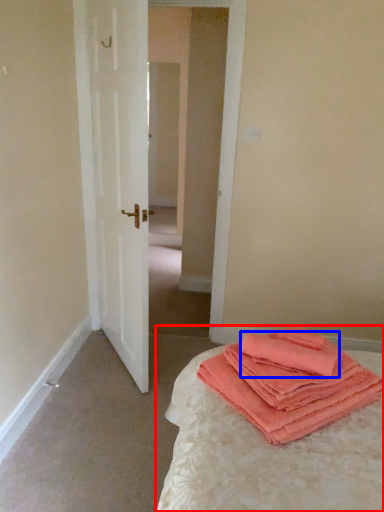
Question: Which point is closer to the camera, bed (highlighted by a red box) or cloth (highlighted by a blue box)?

Choices:
 (A) bed
 (B) cloth

Answer: (A)